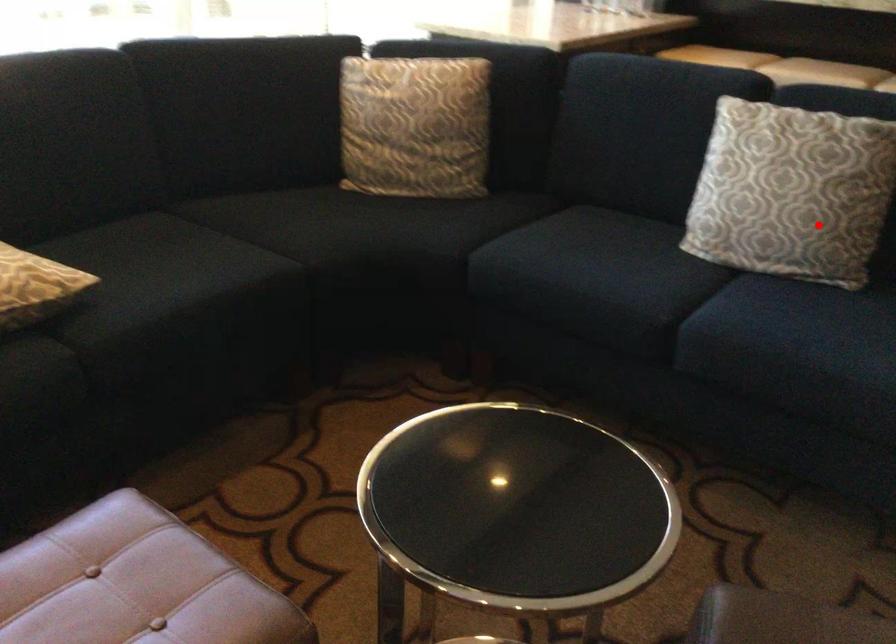
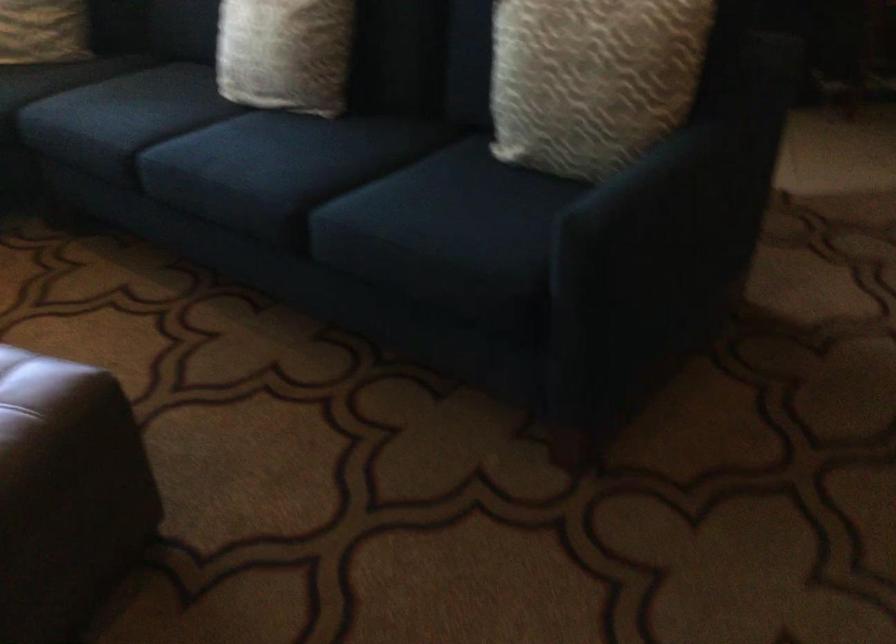
Question: I am providing you with two images of the same scene from different viewpoints. A red point is marked on the first image. At the location where the point appears in image 1, is it still visible in image 2?

Choices:
 (A) Yes
 (B) No

Answer: (A)